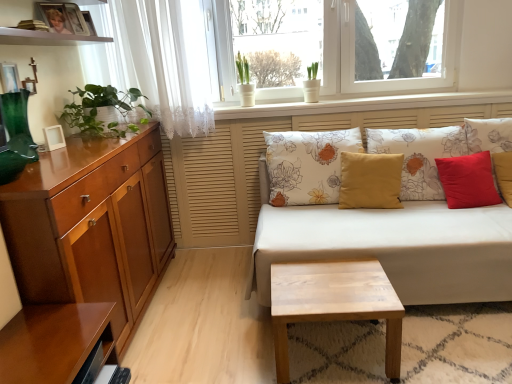
Question: From the image's perspective, is white floral fabric couch at center beneath green glass vase at left?

Choices:
 (A) yes
 (B) no

Answer: (A)

Question: Does white floral fabric couch at center have a greater width compared to green glass vase at left?

Choices:
 (A) no
 (B) yes

Answer: (B)

Question: Does white floral fabric couch at center turn towards green glass vase at left?

Choices:
 (A) no
 (B) yes

Answer: (A)

Question: Would you say white floral fabric couch at center is outside green glass vase at left?

Choices:
 (A) no
 (B) yes

Answer: (B)

Question: Is white floral fabric couch at center thinner than green glass vase at left?

Choices:
 (A) no
 (B) yes

Answer: (A)

Question: Considering the positions of glossy wood shelf at lower left and red matte pillow at right, the first pillow when ordered from right to left, in the image, is glossy wood shelf at lower left taller or shorter than red matte pillow at right, the first pillow when ordered from right to left,?

Choices:
 (A) short
 (B) tall

Answer: (A)

Question: Choose the correct answer: Is glossy wood shelf at lower left inside red matte pillow at right, the first pillow when ordered from right to left, or outside it?

Choices:
 (A) outside
 (B) inside

Answer: (A)

Question: Is glossy wood shelf at lower left to the left or to the right of red matte pillow at right, the first pillow when ordered from right to left, in the image?

Choices:
 (A) left
 (B) right

Answer: (A)

Question: Does point (28, 367) appear closer or farther from the camera than point (506, 140)?

Choices:
 (A) farther
 (B) closer

Answer: (B)

Question: Considering the positions of light wood/texture coffee table at center and glossy wood cabinet at left in the image, is light wood/texture coffee table at center wider or thinner than glossy wood cabinet at left?

Choices:
 (A) thin
 (B) wide

Answer: (B)

Question: In terms of height, does light wood/texture coffee table at center look taller or shorter compared to glossy wood cabinet at left?

Choices:
 (A) short
 (B) tall

Answer: (A)

Question: From the image's perspective, is light wood/texture coffee table at center above or below glossy wood cabinet at left?

Choices:
 (A) below
 (B) above

Answer: (A)

Question: Relative to glossy wood cabinet at left, is light wood/texture coffee table at center in front or behind?

Choices:
 (A) behind
 (B) front

Answer: (A)

Question: Relative to glossy wood cabinet at left, is glossy wood shelf at lower left in front or behind?

Choices:
 (A) behind
 (B) front

Answer: (B)

Question: From the image's perspective, is glossy wood shelf at lower left above or below glossy wood cabinet at left?

Choices:
 (A) below
 (B) above

Answer: (A)